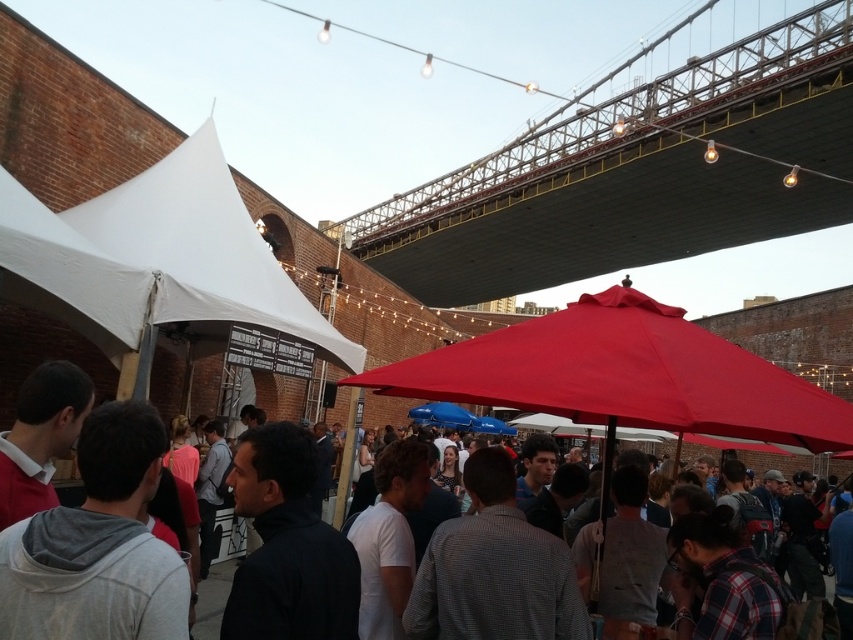
Does red matte umbrella at center have a greater height compared to matte black umbrella at center?

Yes, red matte umbrella at center is taller than matte black umbrella at center.

Is red matte umbrella at center above matte black umbrella at center?

Incorrect, red matte umbrella at center is not positioned above matte black umbrella at center.

What do you see at coordinates (624, 376) in the screenshot? I see `red matte umbrella at center` at bounding box center [624, 376].

You are a GUI agent. You are given a task and a screenshot of the screen. Output one action in this format:
    pyautogui.click(x=<x>, y=<y>)
    Task: Click on the red matte umbrella at center
    Image resolution: width=853 pixels, height=640 pixels.
    Given the screenshot: What is the action you would take?
    pyautogui.click(x=624, y=376)

Between metallic gray bridge at upper center and white fabric canopy at left, which one is positioned higher?

metallic gray bridge at upper center is above.

Who is lower down, metallic gray bridge at upper center or white fabric canopy at left?

white fabric canopy at left is lower down.

Does point (679, 76) come in front of point (276, 307)?

No, (679, 76) is behind (276, 307).

Find the location of `metallic gray bridge at upper center`. metallic gray bridge at upper center is located at coordinates (637, 173).

Does point (41, 276) come behind point (28, 572)?

Yes, it is behind point (28, 572).

The height and width of the screenshot is (640, 853). In order to click on white fabric canopy at left in this screenshot , I will do 158,257.